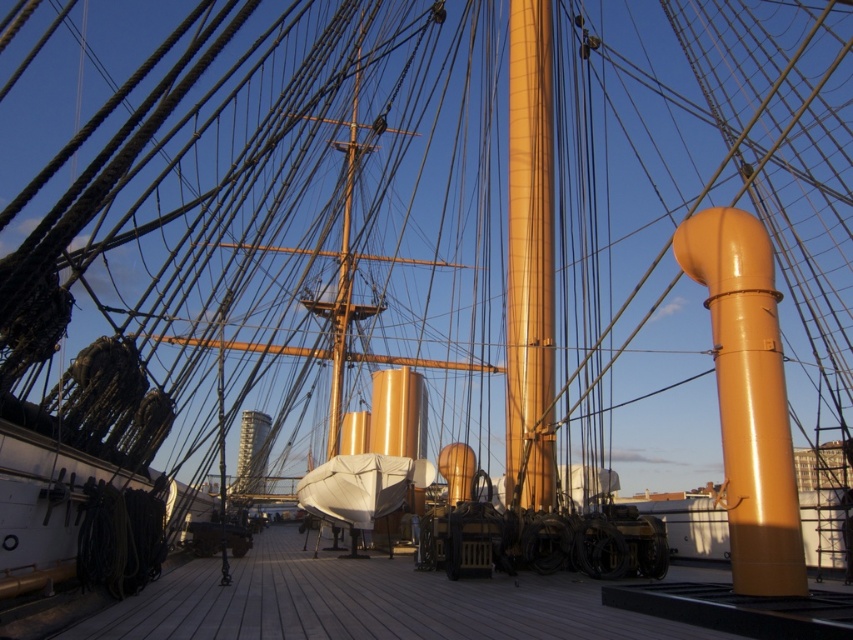
Question: Is glossy orange pipe at right below matte gold mast at center?

Choices:
 (A) no
 (B) yes

Answer: (B)

Question: Is wooden at center wider than matte gold mast at center?

Choices:
 (A) yes
 (B) no

Answer: (A)

Question: Which object is closer to the camera taking this photo?

Choices:
 (A) glossy orange pipe at right
 (B) matte gold mast at center

Answer: (A)

Question: Considering the relative positions of glossy orange pipe at right and matte gold mast at center in the image provided, where is glossy orange pipe at right located with respect to matte gold mast at center?

Choices:
 (A) right
 (B) left

Answer: (A)

Question: Which of the following is the closest to the observer?

Choices:
 (A) wooden at center
 (B) matte gold mast at center

Answer: (A)

Question: Which object appears closest to the camera in this image?

Choices:
 (A) wooden at center
 (B) glossy orange pipe at right

Answer: (A)